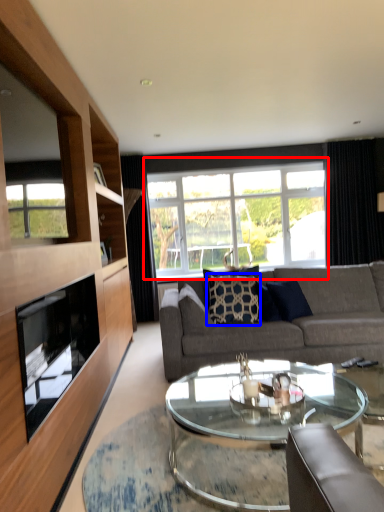
Question: Which point is further to the camera, window (highlighted by a red box) or pillow (highlighted by a blue box)?

Choices:
 (A) window
 (B) pillow

Answer: (A)